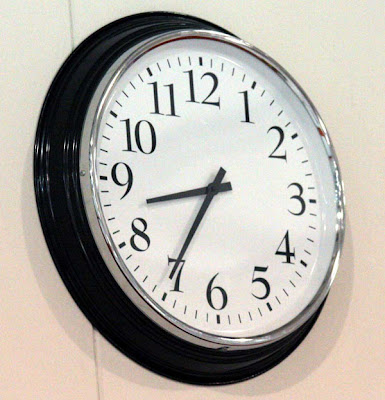
Locate an element on the screen. frame is located at coordinates (53, 151).